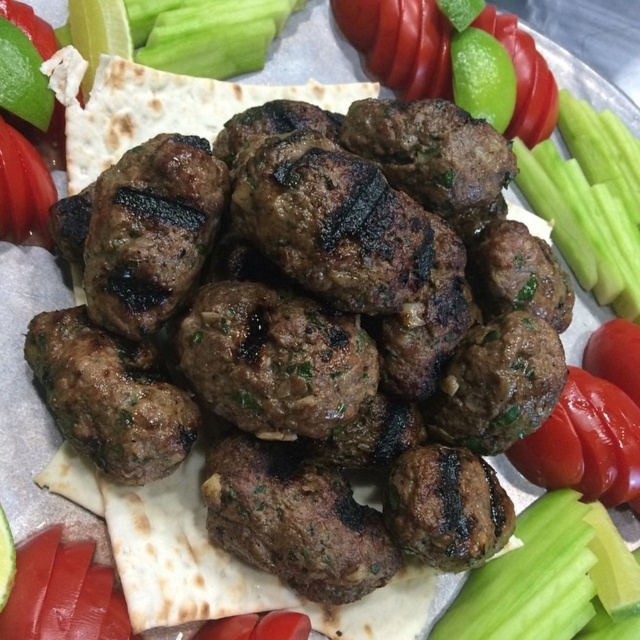
Question: Is brown grilled meatballs at center to the left of green crisp celery at center from the viewer's perspective?

Choices:
 (A) yes
 (B) no

Answer: (A)

Question: Which object is the closest to the red matte tomato at lower right?

Choices:
 (A) green crisp celery at center
 (B) brown grilled meatballs at center

Answer: (A)

Question: Which of the following is the farthest from the observer?

Choices:
 (A) green crisp celery at center
 (B) red matte tomato at lower right

Answer: (A)

Question: Is green crisp celery at center smaller than red matte tomato at lower right?

Choices:
 (A) no
 (B) yes

Answer: (B)

Question: Can you confirm if green crisp celery at center is thinner than red matte tomato at lower right?

Choices:
 (A) no
 (B) yes

Answer: (A)

Question: Which object is closer to the camera taking this photo?

Choices:
 (A) red matte tomato at lower right
 (B) green crisp celery at center
 (C) brown grilled meatballs at center

Answer: (C)